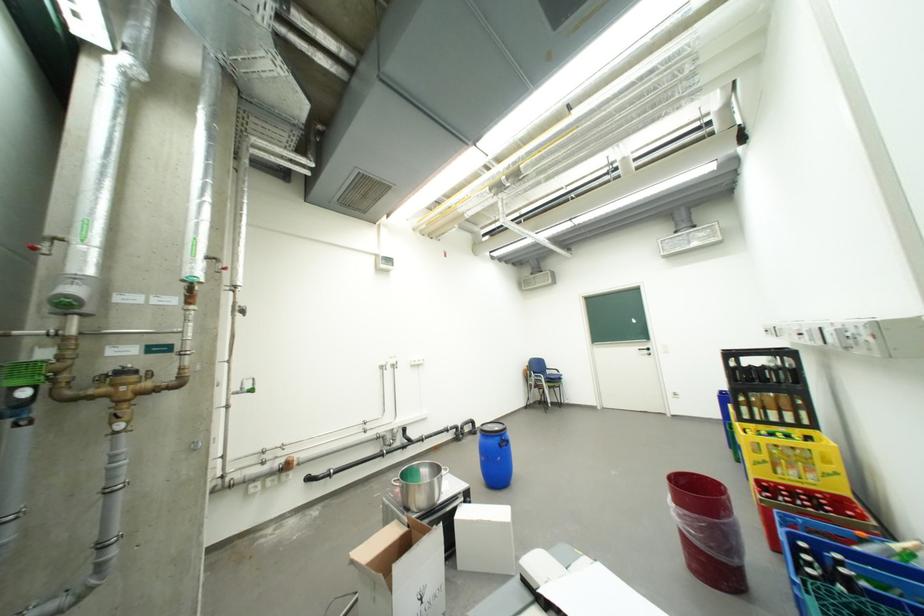
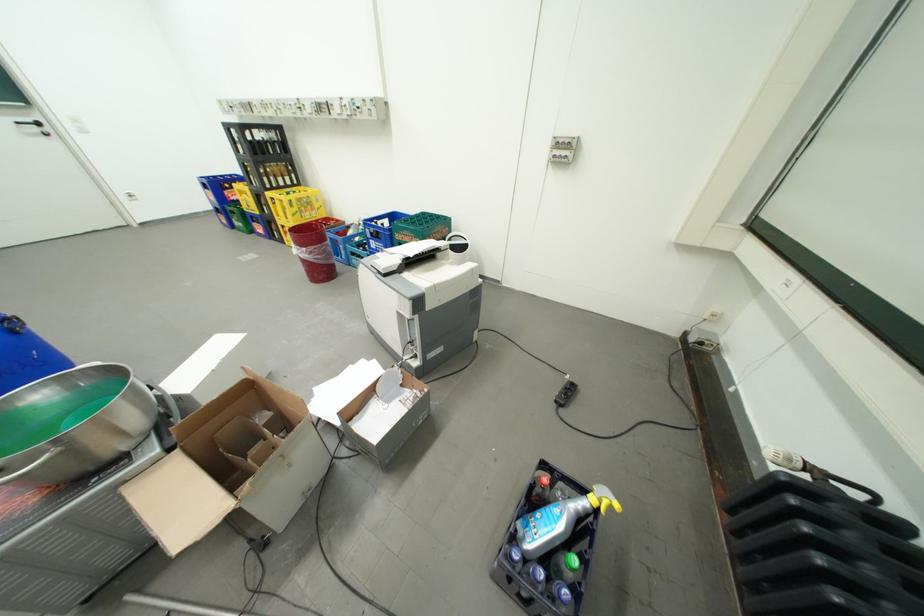
In the second image, find the point that corresponds to pixel 780 467 in the first image.

(310, 215)